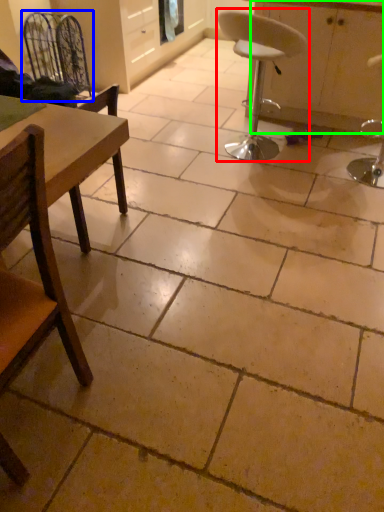
Question: Estimate the real-world distances between objects in this image. Which object is farther from chair (highlighted by a red box), swivel chair (highlighted by a blue box) or cabinetry (highlighted by a green box)?

Choices:
 (A) swivel chair
 (B) cabinetry

Answer: (A)